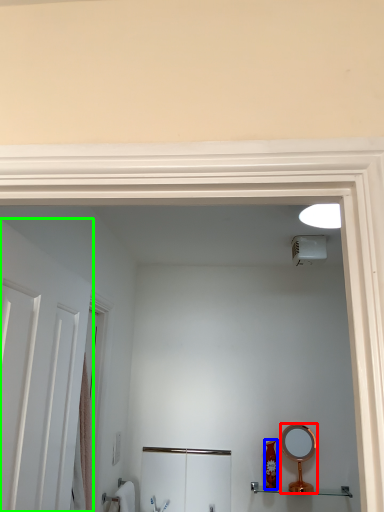
Question: Which object is positioned farthest from mirror (highlighted by a red box)? Select from toiletry (highlighted by a blue box) and door (highlighted by a green box).

Choices:
 (A) toiletry
 (B) door

Answer: (B)